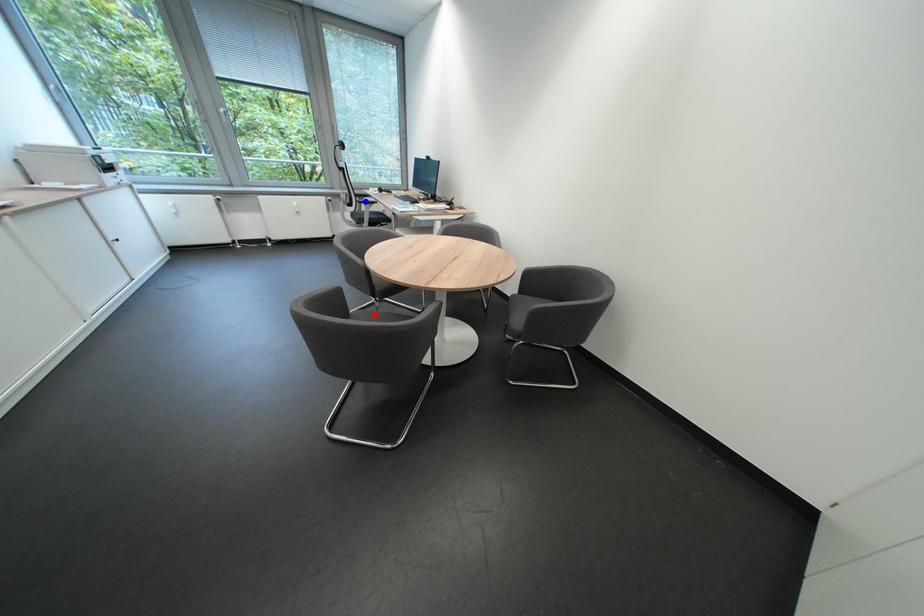
Question: Which of the two points in the image is closer to the camera?

Choices:
 (A) Blue point is closer.
 (B) Red point is closer.

Answer: (B)